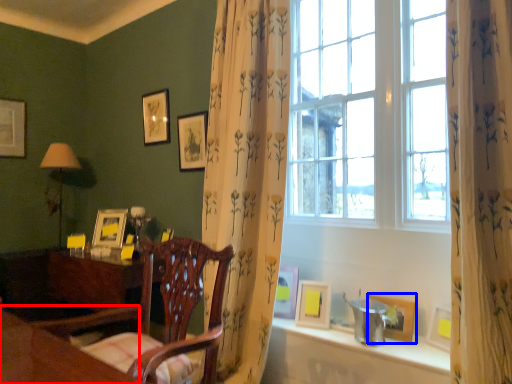
Question: Which object appears farthest to the camera in this image, table (highlighted by a red box) or picture frame (highlighted by a blue box)?

Choices:
 (A) table
 (B) picture frame

Answer: (B)